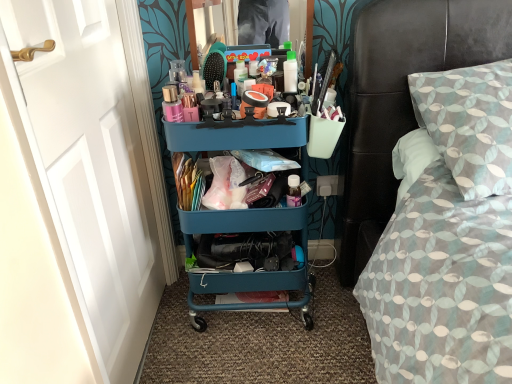
Question: From the image's perspective, is white plastic power outlet at lower center below white painted wood door at left?

Choices:
 (A) no
 (B) yes

Answer: (A)

Question: From a real-world perspective, does white plastic power outlet at lower center stand above white painted wood door at left?

Choices:
 (A) no
 (B) yes

Answer: (A)

Question: Considering the relative sizes of white plastic power outlet at lower center and white painted wood door at left in the image provided, is white plastic power outlet at lower center taller than white painted wood door at left?

Choices:
 (A) yes
 (B) no

Answer: (B)

Question: Considering the relative positions of white plastic power outlet at lower center and white painted wood door at left in the image provided, is white plastic power outlet at lower center to the right of white painted wood door at left from the viewer's perspective?

Choices:
 (A) yes
 (B) no

Answer: (A)

Question: From the image's perspective, does white plastic power outlet at lower center appear higher than white painted wood door at left?

Choices:
 (A) no
 (B) yes

Answer: (B)

Question: Does white plastic power outlet at lower center come behind white painted wood door at left?

Choices:
 (A) no
 (B) yes

Answer: (B)

Question: Is the depth of teal plastic cart at center greater than that of patterned fabric bed at right?

Choices:
 (A) yes
 (B) no

Answer: (A)

Question: Can patterned fabric bed at right be found inside teal plastic cart at center?

Choices:
 (A) yes
 (B) no

Answer: (B)

Question: Considering the relative sizes of teal plastic cart at center and patterned fabric bed at right in the image provided, is teal plastic cart at center taller than patterned fabric bed at right?

Choices:
 (A) no
 (B) yes

Answer: (B)

Question: Is teal plastic cart at center smaller than patterned fabric bed at right?

Choices:
 (A) no
 (B) yes

Answer: (B)

Question: Can you confirm if teal plastic cart at center is positioned to the right of patterned fabric bed at right?

Choices:
 (A) yes
 (B) no

Answer: (B)

Question: Does teal plastic cart at center touch patterned fabric bed at right?

Choices:
 (A) no
 (B) yes

Answer: (A)

Question: Would you say white plastic power outlet at lower center is outside teal plastic cart at center?

Choices:
 (A) yes
 (B) no

Answer: (A)